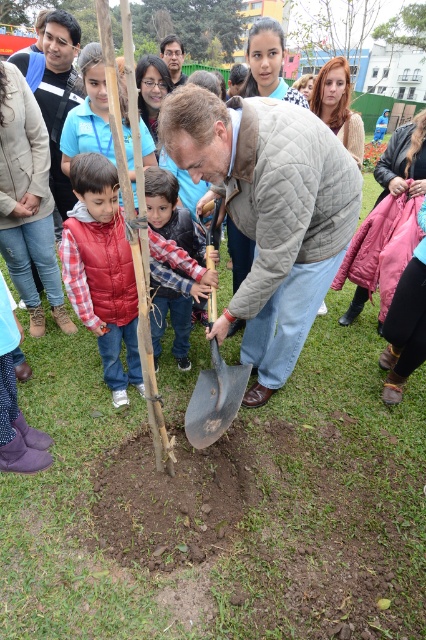
Is red plaid shirt at center below green wood tree at upper center?

Indeed, red plaid shirt at center is positioned under green wood tree at upper center.

Which is in front, point (115, 244) or point (143, 6)?

Positioned in front is point (115, 244).

Which is behind, point (95, 317) or point (209, 28)?

Positioned behind is point (209, 28).

The height and width of the screenshot is (640, 426). Identify the location of red plaid shirt at center. (101, 269).

Does quilted beige jacket at center have a larger size compared to red plaid shirt at center?

Yes.

Does quilted beige jacket at center appear on the right side of red plaid shirt at center?

Yes, quilted beige jacket at center is to the right of red plaid shirt at center.

Which is behind, point (244, 154) or point (118, 208)?

The point (118, 208) is more distant.

The image size is (426, 640). What are the coordinates of `quilted beige jacket at center` in the screenshot? It's located at [x=270, y=212].

Which is more to the right, quilted beige jacket at center or plaid shirt at center?

Positioned to the right is quilted beige jacket at center.

Is quilted beige jacket at center taller than plaid shirt at center?

Indeed, quilted beige jacket at center has a greater height compared to plaid shirt at center.

Which is behind, point (293, 305) or point (152, 310)?

The point (152, 310) is more distant.

This screenshot has height=640, width=426. What are the coordinates of `quilted beige jacket at center` in the screenshot? It's located at [270, 212].